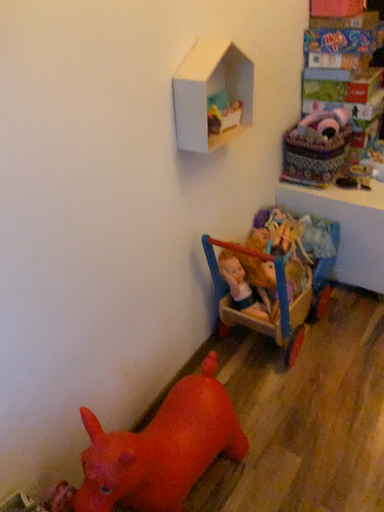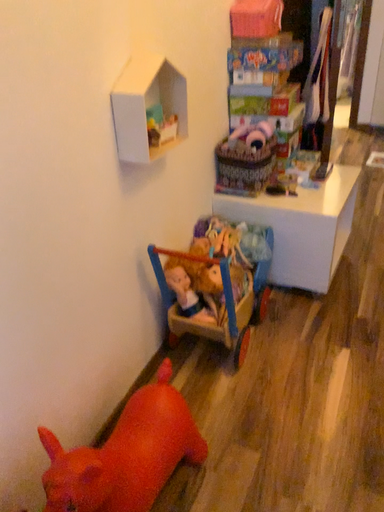
Question: Which way did the camera rotate in the video?

Choices:
 (A) rotated right
 (B) rotated left

Answer: (A)